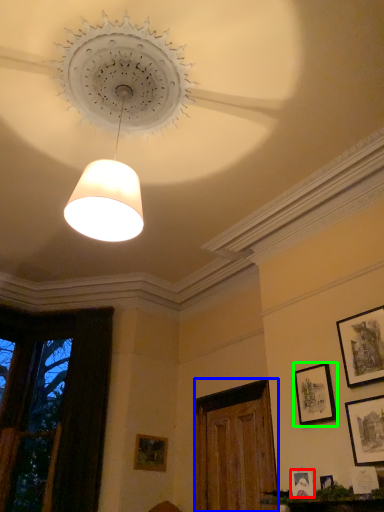
Question: Which object is the closest to the picture frame (highlighted by a red box)? Choose among these: glass door (highlighted by a blue box) or picture frame (highlighted by a green box).

Choices:
 (A) glass door
 (B) picture frame

Answer: (B)